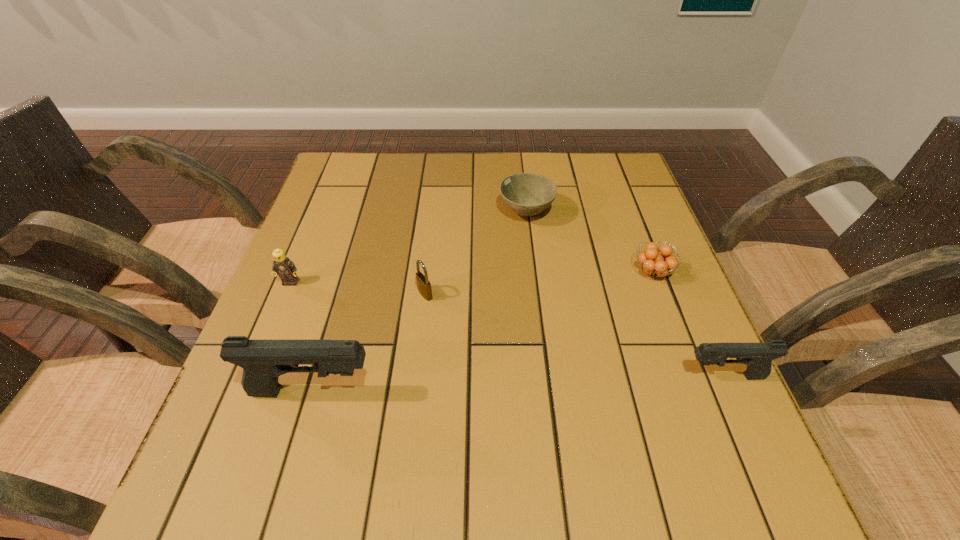
If we want them evenly spaced by inserting an extra pistol among them, please locate a free spot for this new pistol. Please provide its 2D coordinates. Your answer should be formatted as a tuple, i.e. [(x, y)], where the tuple contains the x and y coordinates of a point satisfying the conditions above.

[(521, 383)]